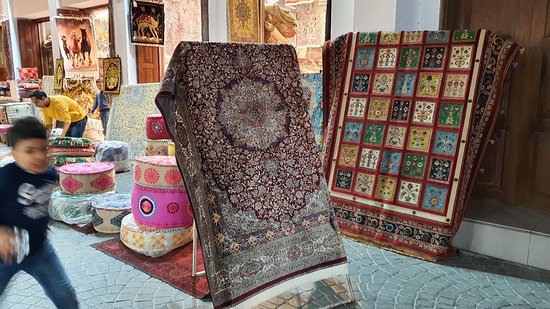
Where is `tuft cushions`? Image resolution: width=550 pixels, height=309 pixels. tuft cushions is located at coordinates (147, 243), (151, 216), (107, 205), (89, 205), (93, 171), (112, 155).